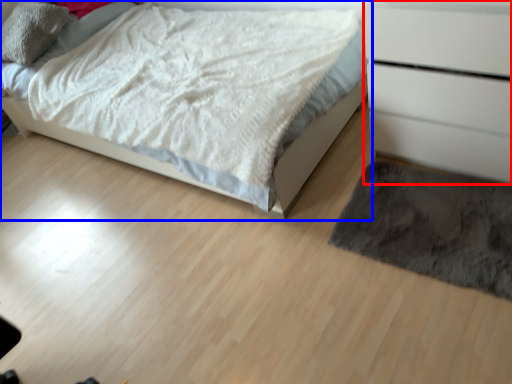
Question: Which object is further to the camera taking this photo, chest of drawers (highlighted by a red box) or bed (highlighted by a blue box)?

Choices:
 (A) chest of drawers
 (B) bed

Answer: (B)